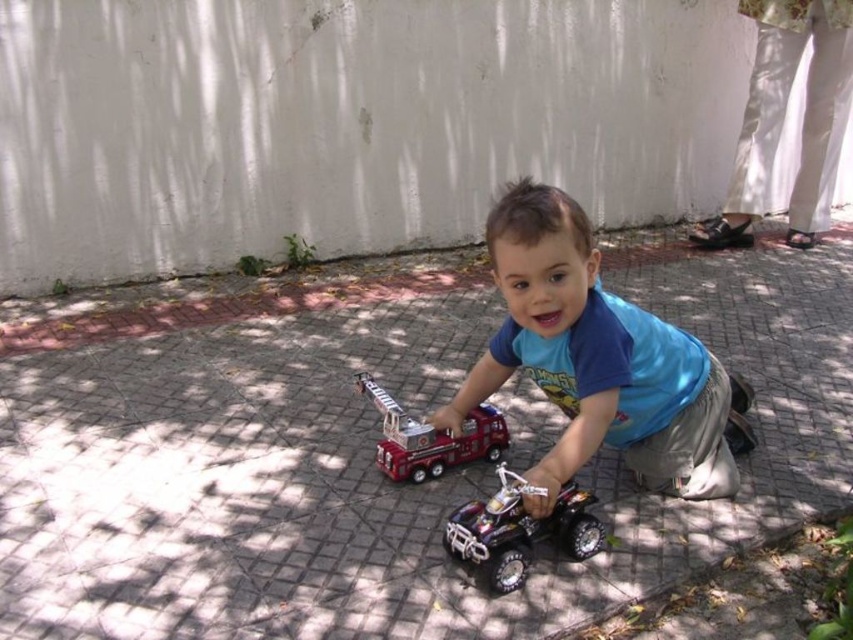
Question: Among these objects, which one is farthest from the camera?

Choices:
 (A) blue matte shirt at center
 (B) metallic silver quad bike at center

Answer: (B)

Question: Can you confirm if gray brick pavement at center is positioned above shiny red fire truck at center?

Choices:
 (A) no
 (B) yes

Answer: (B)

Question: Which point is farther to the camera?

Choices:
 (A) (490, 364)
 (B) (389, 278)
 (C) (381, 438)

Answer: (B)

Question: Is blue matte shirt at center wider than shiny red fire truck at center?

Choices:
 (A) yes
 (B) no

Answer: (A)

Question: Which point is farther from the camera taking this photo?

Choices:
 (A) (474, 401)
 (B) (392, 458)

Answer: (A)

Question: Where is gray brick pavement at center located in relation to blue matte shirt at center in the image?

Choices:
 (A) below
 (B) above

Answer: (B)